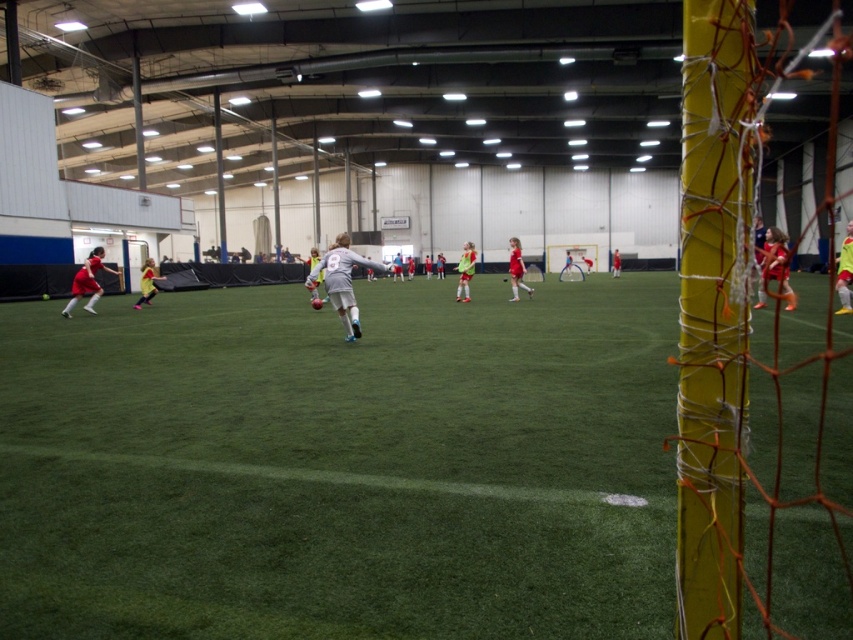
Is gray matte soccer ball at center closer to camera compared to matte red jersey at right?

Yes.

Does gray matte soccer ball at center have a greater width compared to matte red jersey at right?

Indeed, gray matte soccer ball at center has a greater width compared to matte red jersey at right.

Find the location of a particular element. gray matte soccer ball at center is located at coordinates (341, 282).

Identify the location of gray matte soccer ball at center. coord(341,282).

Is gray matte soccer ball at center below yellow jersey at left?

Correct, gray matte soccer ball at center is located below yellow jersey at left.

This screenshot has width=853, height=640. What do you see at coordinates (341, 282) in the screenshot? I see `gray matte soccer ball at center` at bounding box center [341, 282].

Where is `gray matte soccer ball at center`? This screenshot has height=640, width=853. gray matte soccer ball at center is located at coordinates (341, 282).

Is gray matte soccer ball at center behind matte red jersey at left?

No.

Is gray matte soccer ball at center to the right of matte red jersey at left from the viewer's perspective?

Indeed, gray matte soccer ball at center is positioned on the right side of matte red jersey at left.

Is point (346, 268) in front of point (74, 282)?

Yes, point (346, 268) is in front of point (74, 282).

I want to click on gray matte soccer ball at center, so click(341, 282).